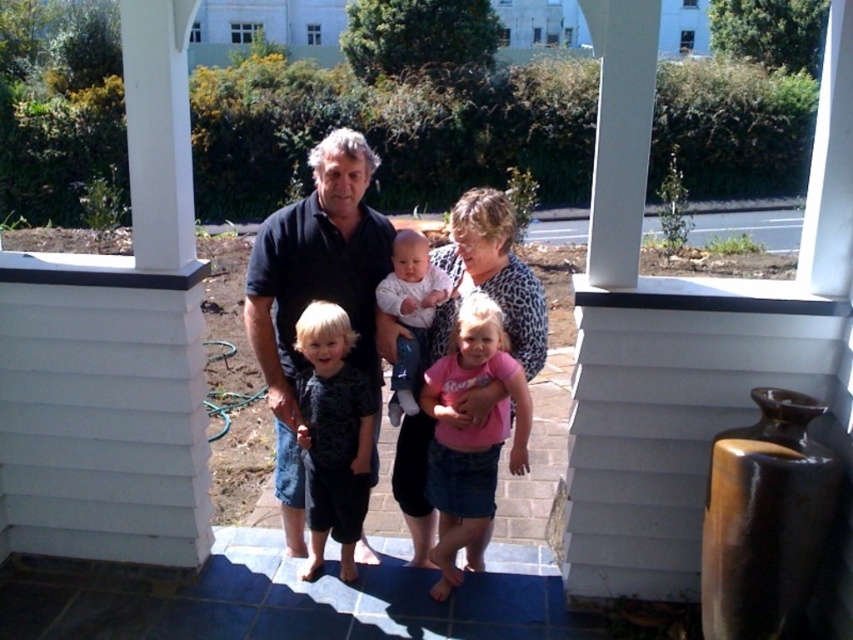
You are a photographer trying to capture a candid family photo. You need to ensure that both the matte black shirt at center and the white cotton baby at center are in focus. Given that your camera has a depth of field that can cover 5 inches, will both subjects be in focus?

The distance between the matte black shirt at center and the white cotton baby at center is 5.55 inches, which exceeds the camera depth of field of 5 inches. Therefore, both subjects cannot be in focus simultaneously.

You are trying to decide which shirt to wear for a casual day out. Both the matte black shirt at center and the black cotton shirt at center are options. Based on the image, which one has a looser fit?

The matte black shirt at center might be wider than black cotton shirt at center, so it likely has a looser fit.